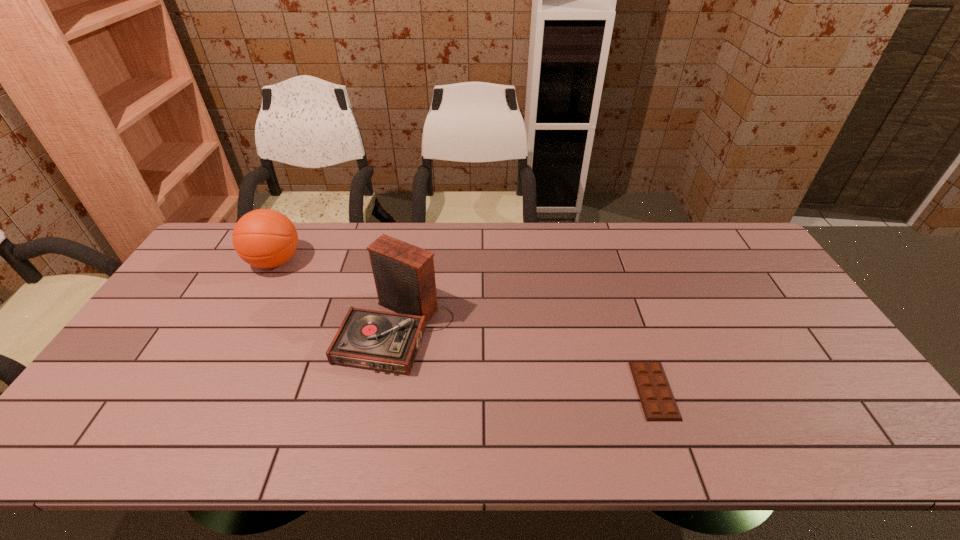
This screenshot has width=960, height=540. I want to click on the second object from right to left, so click(404, 275).

Where is `the leftmost object`? The image size is (960, 540). the leftmost object is located at coordinates (265, 238).

Where is `basketball`? basketball is located at coordinates (265, 238).

Locate an element on the screen. Image resolution: width=960 pixels, height=540 pixels. the rightmost object is located at coordinates (658, 403).

The width and height of the screenshot is (960, 540). I want to click on chocolate bar, so click(x=658, y=403).

The image size is (960, 540). In order to click on free space located 0.250m on the right of the phonograph record in this screenshot , I will do 541,329.

Find the location of a particular element. This screenshot has width=960, height=540. vacant space located on the front of the leftmost object is located at coordinates (252, 303).

This screenshot has width=960, height=540. Identify the location of vacant area located 0.390m on the back of the rightmost object. (612, 266).

Locate an element on the screen. Image resolution: width=960 pixels, height=540 pixels. object located at the far edge is located at coordinates (265, 238).

This screenshot has width=960, height=540. I want to click on object that is at the near edge, so click(x=658, y=403).